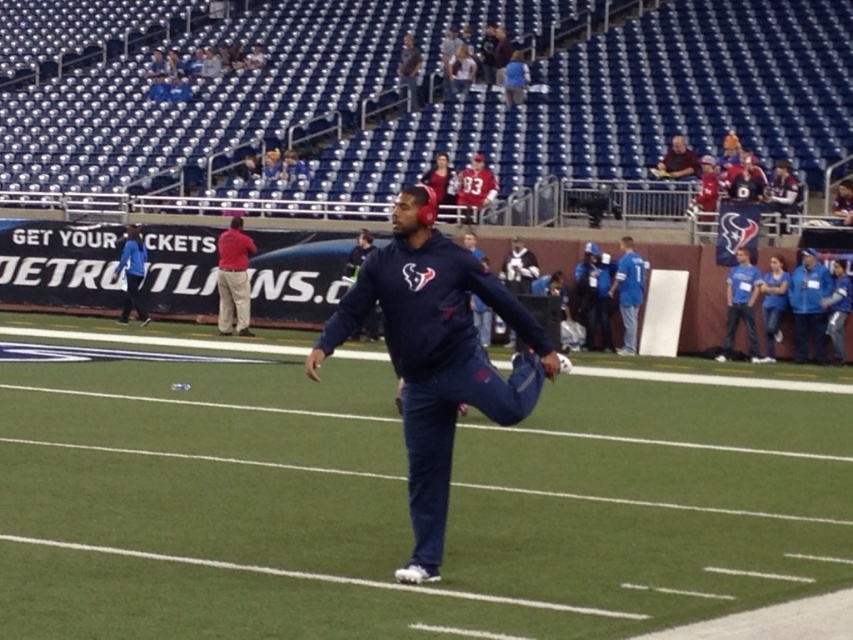
Looking at this image, between dark blue pants at center and navy blue hoodie at center, which one appears on the right side from the viewer's perspective?

dark blue pants at center

Who is more forward, (299, 412) or (514, 417)?

Point (514, 417) is more forward.

Where is `dark blue pants at center`? dark blue pants at center is located at coordinates (396, 493).

Between dark blue pants at center and blue jersey at right, which one has more height?

Standing taller between the two is blue jersey at right.

Between dark blue pants at center and blue jersey at right, which one is positioned lower?

dark blue pants at center

Locate an element on the screen. dark blue pants at center is located at coordinates (396, 493).

Find the location of a particular element. Image resolution: width=853 pixels, height=640 pixels. dark blue pants at center is located at coordinates (396, 493).

Who is lower down, dark blue pants at center or blue fabric jacket at left?

Positioned lower is dark blue pants at center.

Image resolution: width=853 pixels, height=640 pixels. What do you see at coordinates (396, 493) in the screenshot?
I see `dark blue pants at center` at bounding box center [396, 493].

Is point (772, 385) positioned behind point (136, 269)?

No, (772, 385) is closer to viewer.

Locate an element on the screen. The image size is (853, 640). dark blue pants at center is located at coordinates (396, 493).